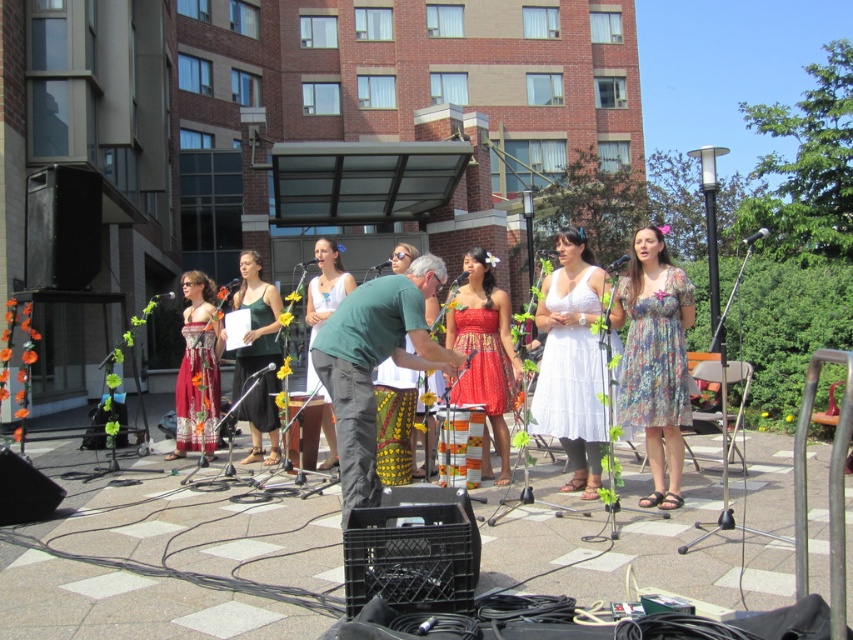
From the picture: You are a photographer at the outdoor performance area. You need to take a photo of both the white cotton dress at center and the printed cotton dress at center. Which dress should you focus on first if you want to capture them from left to right in the frame?

You should focus on the printed cotton dress at center first because the white cotton dress at center is to the right of it, so arranging them from left to right would start with the printed cotton dress at center followed by the white cotton dress at center.

You are a photographer at the event and want to capture a photo of the green cotton shirt at center without the red satin dress at center blocking it. What should you do?

Move the camera backward to position the green cotton shirt at center behind the red satin dress at center, since the red satin dress at center is in front of the green cotton shirt at center.

You are an event organizer who needs to ensure that the red printed fabric dress at center and the green cotton shirt at center are visible to the audience. Based on their positions, which one is more likely to be obscured by the other?

The red printed fabric dress at center is located below the green cotton shirt at center, so it is more likely to be obscured by the green cotton shirt at center.